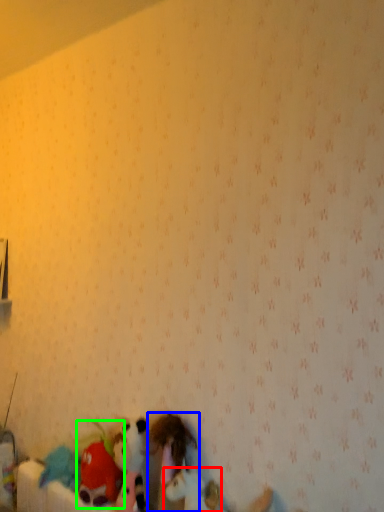
Question: Which object is the farthest from toy (highlighted by a red box)? Choose among these: toy (highlighted by a blue box) or toy (highlighted by a green box).

Choices:
 (A) toy
 (B) toy

Answer: (B)